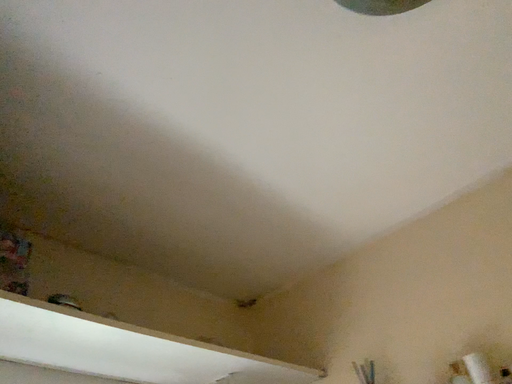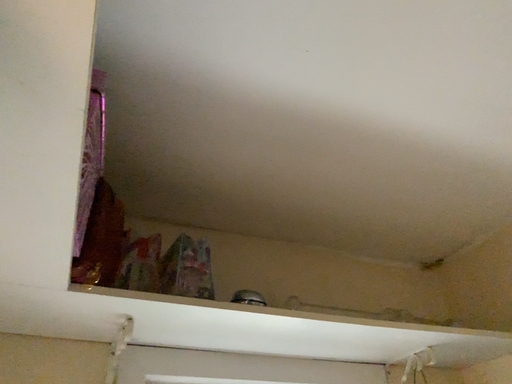
Question: How did the camera likely rotate when shooting the video?

Choices:
 (A) rotated downward
 (B) rotated upward

Answer: (A)